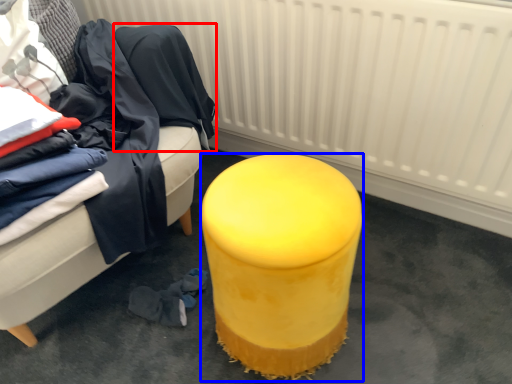
Question: Which point is further to the camera, clothing (highlighted by a red box) or stool (highlighted by a blue box)?

Choices:
 (A) clothing
 (B) stool

Answer: (A)